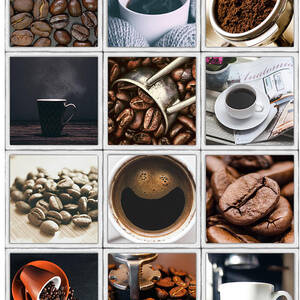
This screenshot has height=300, width=300. I want to click on white edges of the coffee cup, so click(x=241, y=290), click(x=242, y=111), click(x=122, y=166), click(x=150, y=25), click(x=224, y=32), click(x=56, y=279).